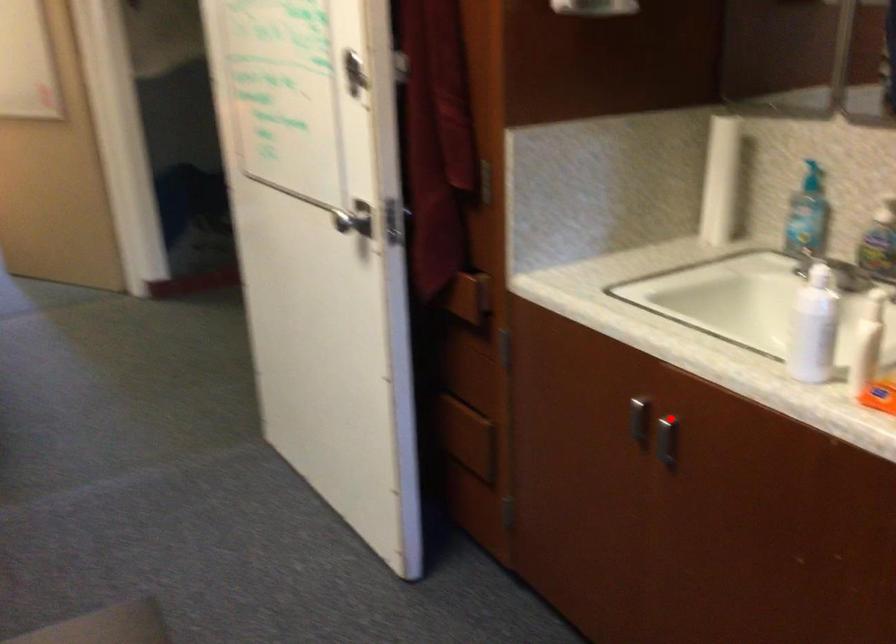
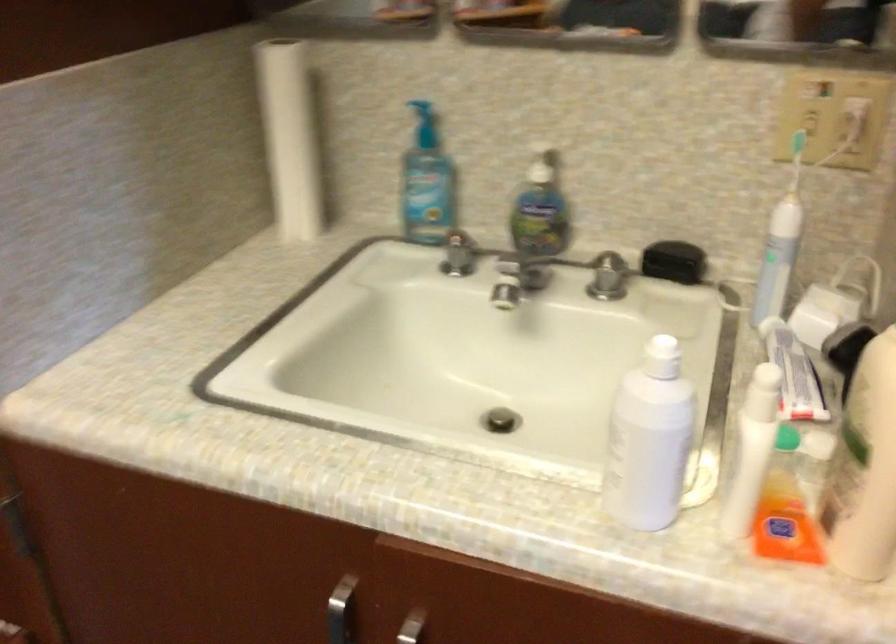
Find the pixel in the second image that matches the highlighted location in the first image.

(411, 627)